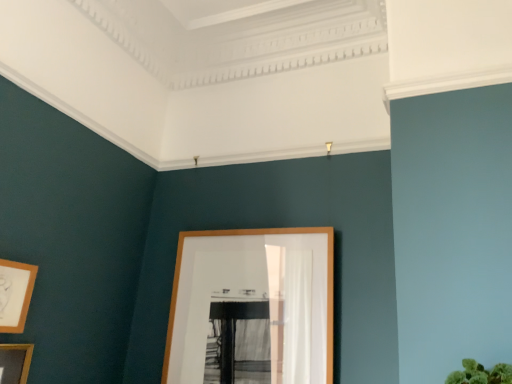
Question: Considering the relative sizes of wooden picture frame at lower left, which ranks as the 2th picture frame in left-to-right order, and wooden picture frame at center, positioned as the third picture frame in left-to-right order, in the image provided, is wooden picture frame at lower left, which ranks as the 2th picture frame in left-to-right order, thinner than wooden picture frame at center, positioned as the third picture frame in left-to-right order,?

Choices:
 (A) no
 (B) yes

Answer: (B)

Question: Is wooden picture frame at lower left, the 2th picture frame when ordered from right to left, completely or partially outside of wooden picture frame at center, the 1th picture frame positioned from the right?

Choices:
 (A) no
 (B) yes

Answer: (B)

Question: From a real-world perspective, is wooden picture frame at lower left, the 2th picture frame when ordered from right to left, over wooden picture frame at center, positioned as the third picture frame in left-to-right order?

Choices:
 (A) yes
 (B) no

Answer: (B)

Question: Considering the relative sizes of wooden picture frame at lower left, the 2th picture frame when ordered from right to left, and wooden picture frame at center, the 1th picture frame positioned from the right, in the image provided, is wooden picture frame at lower left, the 2th picture frame when ordered from right to left, smaller than wooden picture frame at center, the 1th picture frame positioned from the right,?

Choices:
 (A) no
 (B) yes

Answer: (B)

Question: Is wooden picture frame at lower left, which ranks as the 2th picture frame in left-to-right order, bigger than wooden picture frame at center, the 1th picture frame positioned from the right?

Choices:
 (A) yes
 (B) no

Answer: (B)

Question: Is wooden picture frame at lower left, the 2th picture frame when ordered from right to left, not near wooden picture frame at center, positioned as the third picture frame in left-to-right order?

Choices:
 (A) yes
 (B) no

Answer: (B)

Question: From the image's perspective, is wooden picture frame at center, positioned as the third picture frame in left-to-right order, on wooden picture frame at lower left, which ranks as the 2th picture frame in left-to-right order?

Choices:
 (A) no
 (B) yes

Answer: (A)

Question: From a real-world perspective, is wooden picture frame at center, the 1th picture frame positioned from the right, below wooden picture frame at lower left, which ranks as the 2th picture frame in left-to-right order?

Choices:
 (A) yes
 (B) no

Answer: (B)

Question: From the image's perspective, is wooden picture frame at center, the 1th picture frame positioned from the right, located beneath wooden picture frame at lower left, the 2th picture frame when ordered from right to left?

Choices:
 (A) yes
 (B) no

Answer: (A)

Question: Is wooden picture frame at center, positioned as the third picture frame in left-to-right order, completely or partially outside of wooden picture frame at lower left, which ranks as the 2th picture frame in left-to-right order?

Choices:
 (A) yes
 (B) no

Answer: (A)

Question: Considering the relative positions of wooden picture frame at center, the 1th picture frame positioned from the right, and wooden picture frame at lower left, which ranks as the 2th picture frame in left-to-right order, in the image provided, is wooden picture frame at center, the 1th picture frame positioned from the right, to the left of wooden picture frame at lower left, which ranks as the 2th picture frame in left-to-right order, from the viewer's perspective?

Choices:
 (A) yes
 (B) no

Answer: (B)

Question: Is wooden picture frame at center, the 1th picture frame positioned from the right, closer to camera compared to wooden picture frame at lower left, the 2th picture frame when ordered from right to left?

Choices:
 (A) yes
 (B) no

Answer: (B)

Question: From a real-world perspective, does wooden picture frame at lower left, which ranks as the 1th picture frame in left-to-right order, sit lower than wooden picture frame at lower left, which ranks as the 2th picture frame in left-to-right order?

Choices:
 (A) yes
 (B) no

Answer: (A)